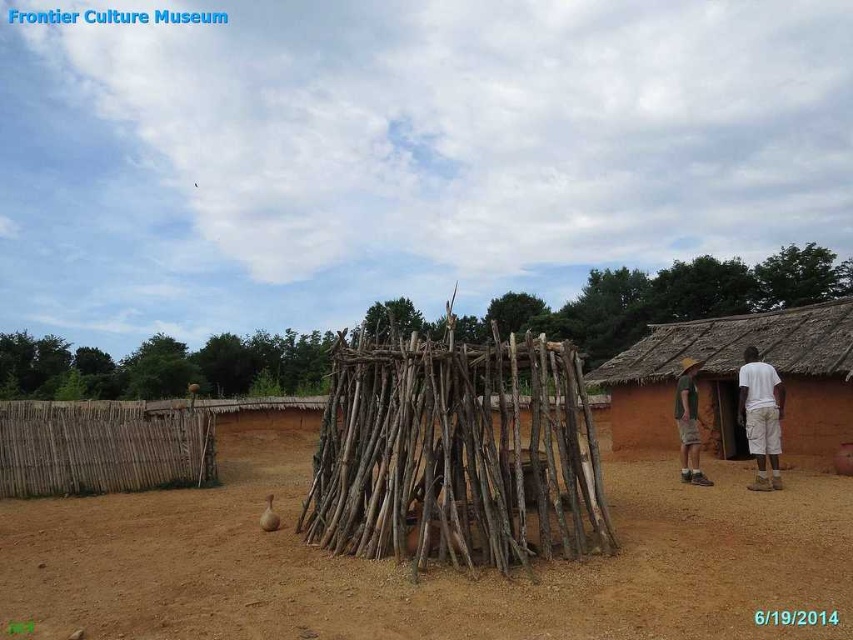
Does brown dirt field at center appear on the right side of brown mud hut at right?

No, brown dirt field at center is not to the right of brown mud hut at right.

Is brown dirt field at center below brown mud hut at right?

Correct, brown dirt field at center is located below brown mud hut at right.

Locate an element on the screen. brown dirt field at center is located at coordinates (431, 572).

Where is `brown dirt field at center`? The image size is (853, 640). brown dirt field at center is located at coordinates (431, 572).

Can you confirm if brown mud hut at right is positioned to the right of white cotton shirt at right?

Correct, you'll find brown mud hut at right to the right of white cotton shirt at right.

Find the location of a particular element. brown mud hut at right is located at coordinates (735, 380).

Identify the location of brown mud hut at right. (735, 380).

In the scene shown: Who is positioned more to the right, white cotton shirt at right or tan fabric shorts at lower right?

From the viewer's perspective, white cotton shirt at right appears more on the right side.

Is white cotton shirt at right thinner than tan fabric shorts at lower right?

Incorrect, white cotton shirt at right's width is not less than tan fabric shorts at lower right's.

Is point (746, 412) positioned behind point (677, 403)?

That is False.

Where is `white cotton shirt at right`? The height and width of the screenshot is (640, 853). white cotton shirt at right is located at coordinates (761, 417).